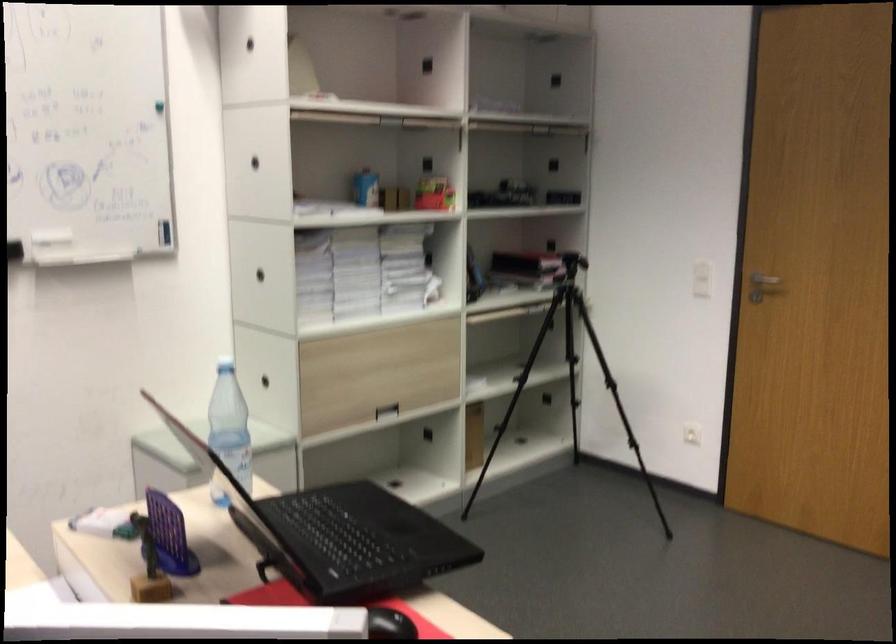
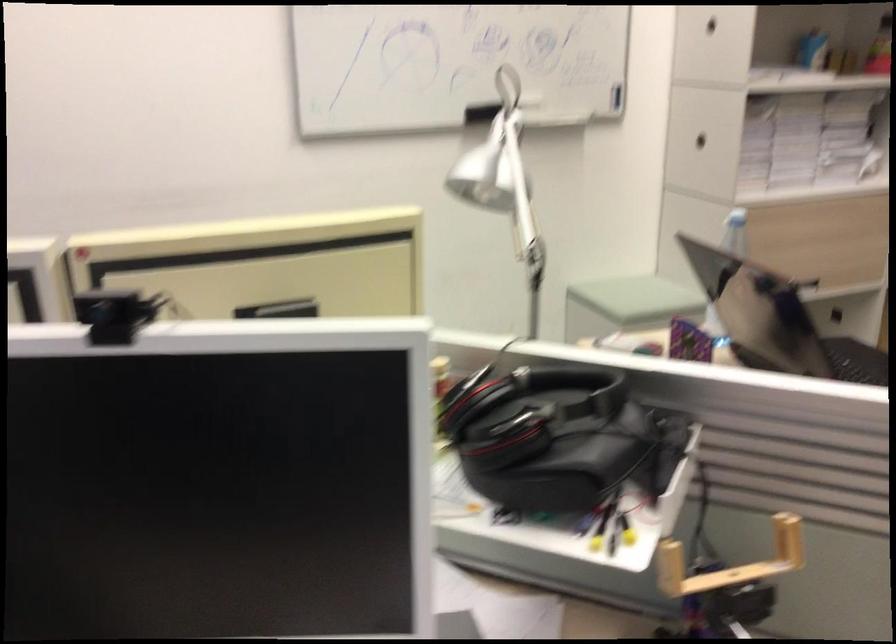
In the second image, find the point that corresponds to (x=250, y=165) in the first image.

(711, 24)